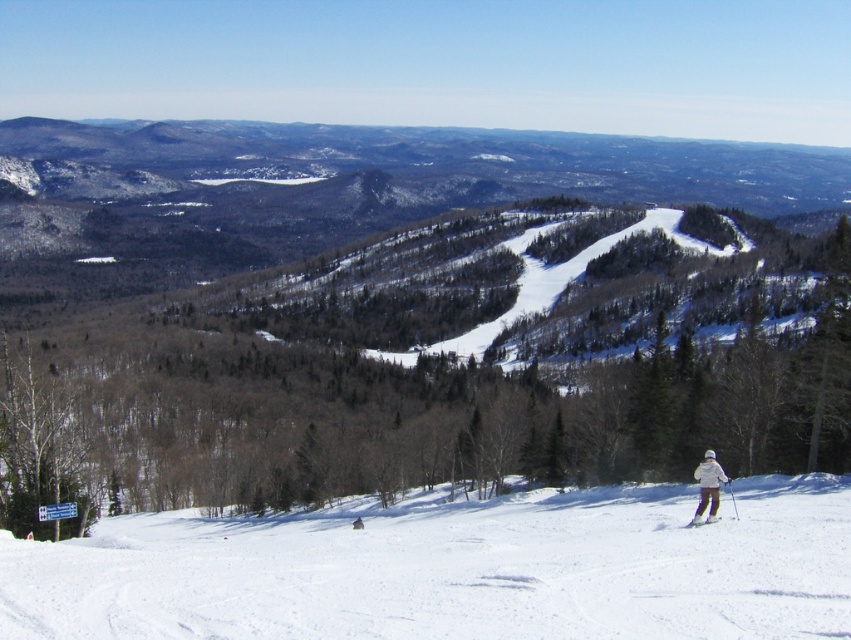
Does white powdery snow at lower center have a lesser height compared to white matte jacket at lower right?

No.

Is white powdery snow at lower center taller than white matte jacket at lower right?

Yes.

What do you see at coordinates (454, 570) in the screenshot? I see `white powdery snow at lower center` at bounding box center [454, 570].

Identify the location of white powdery snow at lower center. (454, 570).

Between point (707, 516) and point (706, 518), which one is positioned behind?

The point (707, 516) is more distant.

Between white matte jacket at lower right and white matte ski at lower right, which one is positioned lower?

white matte ski at lower right is lower down.

Is point (710, 518) in front of point (687, 525)?

No, (710, 518) is further to viewer.

You are a GUI agent. You are given a task and a screenshot of the screen. Output one action in this format:
    pyautogui.click(x=<x>, y=<y>)
    Task: Click on the white matte jacket at lower right
    
    Given the screenshot: What is the action you would take?
    pyautogui.click(x=707, y=486)

Is point (332, 532) positioned behind point (709, 518)?

Yes.

Looking at this image, between white powdery snow at lower center and white matte ski at lower right, which one is positioned lower?

white powdery snow at lower center is lower down.

Image resolution: width=851 pixels, height=640 pixels. I want to click on white powdery snow at lower center, so click(454, 570).

Find the location of a particular element. The height and width of the screenshot is (640, 851). white powdery snow at lower center is located at coordinates (454, 570).